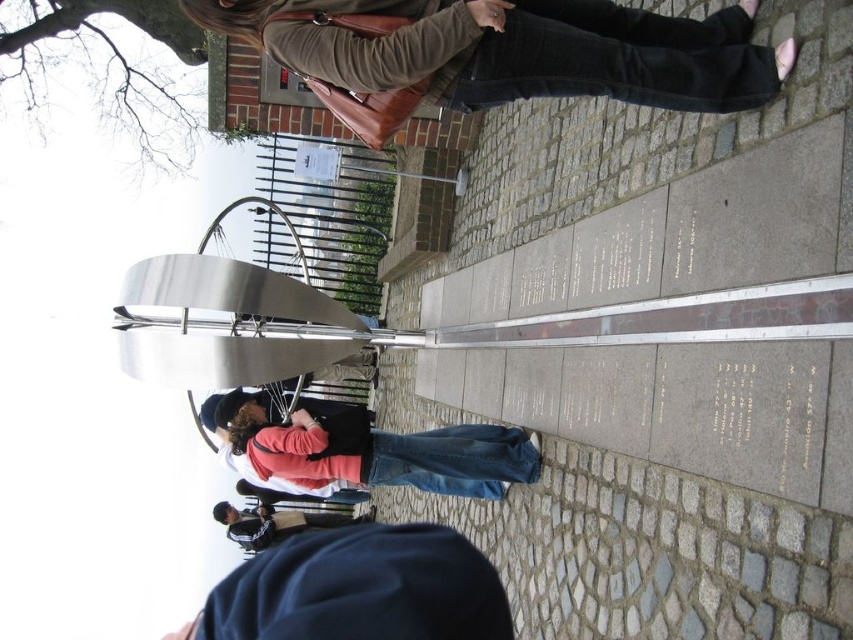
You are standing at the camera position looking at the installation. There are two points marked on the ground in front of you. The first point is at coordinates point (502, 83) and the second point is at point (276, 541). Which point is closer to you?

Point (502, 83) is closer to the camera than point (276, 541).

You are a photographer trying to capture both the brown leather jacket at upper center and the black leather skateboard at lower center in a single shot. However, you can only focus on one object at a time. Which object should you focus on to ensure the other remains in the background?

You should focus on the brown leather jacket at upper center because it is in front of the black leather skateboard at lower center, so if you focus on the front object, the one behind will stay in the background.

You are a photographer setting up a tripod to capture the metallic sculpture in the center of the image. You notice the denim pants at lower center and the black leather skateboard at lower center in your frame. Since you want to focus on the sculpture, which object should you move to avoid blocking the view?

The denim pants at lower center should be moved because its width is larger than the black leather skateboard at lower center, making it more likely to obstruct the view of the sculpture.